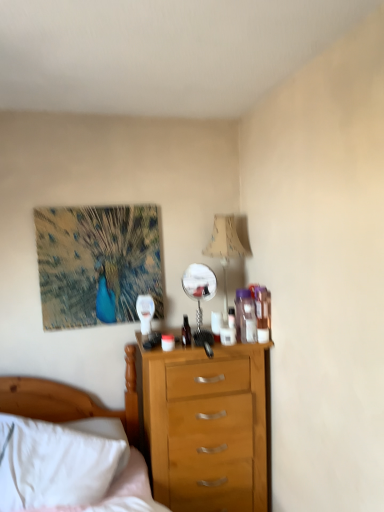
Question: Considering the relative sizes of white soft bed at lower left and textured canvas peacock at upper left in the image provided, is white soft bed at lower left shorter than textured canvas peacock at upper left?

Choices:
 (A) yes
 (B) no

Answer: (B)

Question: Considering the relative positions of white soft bed at lower left and textured canvas peacock at upper left in the image provided, is white soft bed at lower left behind textured canvas peacock at upper left?

Choices:
 (A) no
 (B) yes

Answer: (A)

Question: Considering the relative positions of white soft bed at lower left and textured canvas peacock at upper left in the image provided, is white soft bed at lower left to the right of textured canvas peacock at upper left from the viewer's perspective?

Choices:
 (A) yes
 (B) no

Answer: (B)

Question: Would you consider white soft bed at lower left to be distant from textured canvas peacock at upper left?

Choices:
 (A) no
 (B) yes

Answer: (A)

Question: From a real-world perspective, is white soft bed at lower left positioned over textured canvas peacock at upper left based on gravity?

Choices:
 (A) yes
 (B) no

Answer: (B)

Question: Is white soft bed at lower left taller or shorter than beige fabric lampshade at upper right?

Choices:
 (A) short
 (B) tall

Answer: (B)

Question: In terms of width, does white soft bed at lower left look wider or thinner when compared to beige fabric lampshade at upper right?

Choices:
 (A) thin
 (B) wide

Answer: (A)

Question: Is white soft bed at lower left inside or outside of beige fabric lampshade at upper right?

Choices:
 (A) inside
 (B) outside

Answer: (B)

Question: Considering their positions, is white soft bed at lower left located in front of or behind beige fabric lampshade at upper right?

Choices:
 (A) behind
 (B) front

Answer: (B)

Question: Considering their positions, is polished silver mirror at center located in front of or behind white soft bed at lower left?

Choices:
 (A) behind
 (B) front

Answer: (A)

Question: From their relative heights in the image, would you say polished silver mirror at center is taller or shorter than white soft bed at lower left?

Choices:
 (A) short
 (B) tall

Answer: (A)

Question: From a real-world perspective, relative to white soft bed at lower left, is polished silver mirror at center vertically above or below?

Choices:
 (A) above
 (B) below

Answer: (A)

Question: Is polished silver mirror at center spatially inside white soft bed at lower left, or outside of it?

Choices:
 (A) inside
 (B) outside

Answer: (B)

Question: Looking at their shapes, would you say polished silver mirror at center is wider or thinner than textured canvas peacock at upper left?

Choices:
 (A) wide
 (B) thin

Answer: (A)

Question: From a real-world perspective, is polished silver mirror at center physically located above or below textured canvas peacock at upper left?

Choices:
 (A) above
 (B) below

Answer: (B)